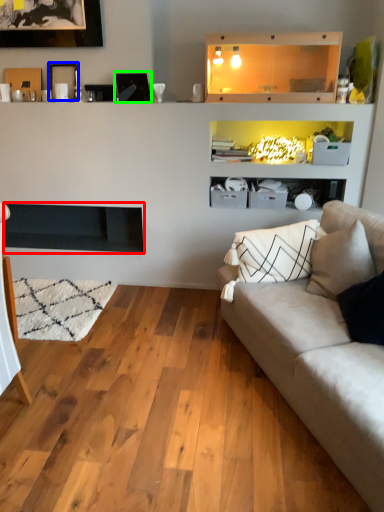
Question: Which object is the closest to the fireplace (highlighted by a red box)? Choose among these: picture frame (highlighted by a blue box) or picture frame (highlighted by a green box).

Choices:
 (A) picture frame
 (B) picture frame

Answer: (A)